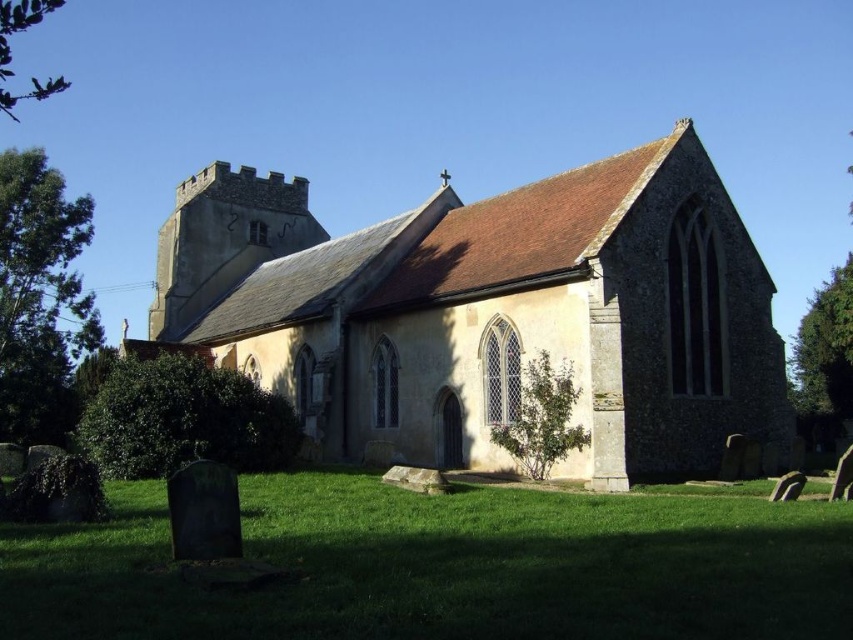
Does brown stone church at center have a greater height compared to green grass at lower center?

Correct, brown stone church at center is much taller as green grass at lower center.

Who is more distant from viewer, (271, 244) or (138, 627)?

Point (271, 244)

The height and width of the screenshot is (640, 853). I want to click on brown stone church at center, so click(490, 312).